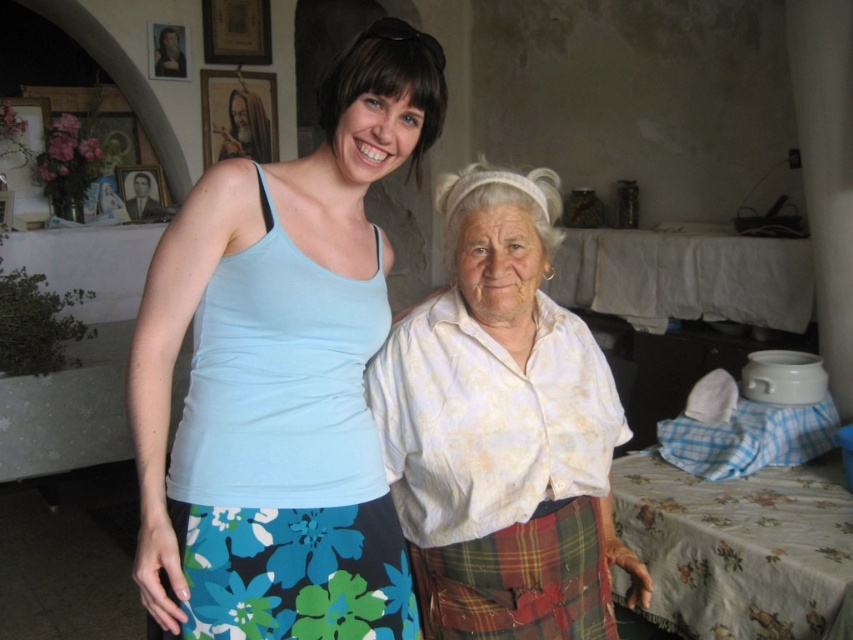
Is white cloth at center taller than wooden frame at upper center?

Incorrect, white cloth at center's height is not larger of wooden frame at upper center's.

Is white cloth at center closer to camera compared to wooden frame at upper center?

Yes, white cloth at center is closer to the viewer.

In order to click on white cloth at center in this screenshot , I will do `click(685, 276)`.

Does white floral blouse at center appear over floral printed fabric at lower right?

Yes, white floral blouse at center is above floral printed fabric at lower right.

Is white floral blouse at center wider than floral printed fabric at lower right?

Incorrect, white floral blouse at center's width does not surpass floral printed fabric at lower right's.

Identify the location of white floral blouse at center. (281, 376).

Who is shorter, white textured shirt at center or wooden photo frame at upper left?

wooden photo frame at upper left is shorter.

Between white textured shirt at center and wooden photo frame at upper left, which one is positioned lower?

Positioned lower is white textured shirt at center.

Between point (535, 314) and point (132, 173), which one is positioned in front?

Point (535, 314)

Locate an element on the screen. The width and height of the screenshot is (853, 640). white textured shirt at center is located at coordinates (502, 429).